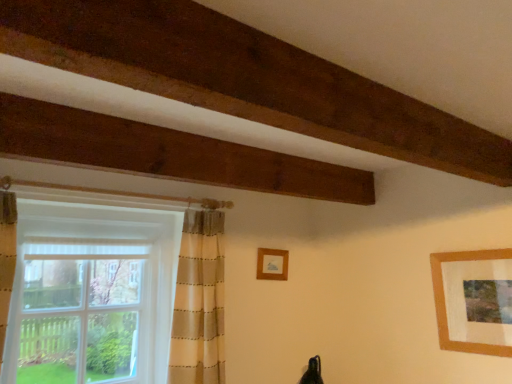
The height and width of the screenshot is (384, 512). What do you see at coordinates (272, 264) in the screenshot?
I see `wooden frame at center, positioned as the 1th picture frame in back-to-front order` at bounding box center [272, 264].

The height and width of the screenshot is (384, 512). I want to click on white sheer curtain at left, so click(91, 294).

Is wooden frame at center, positioned as the 1th picture frame in back-to-front order, located outside white sheer curtain at left?

Yes, wooden frame at center, positioned as the 1th picture frame in back-to-front order, is located beyond the bounds of white sheer curtain at left.

Based on the photo, looking at the image, does wooden frame at center, which ranks as the 2th picture frame in front-to-back order, seem bigger or smaller compared to white sheer curtain at left?

wooden frame at center, which ranks as the 2th picture frame in front-to-back order, is smaller than white sheer curtain at left.

Considering the sizes of objects wooden picture frame at upper right, which appears as the first picture frame when viewed from the right, and wooden frame at center, the 1th picture frame when ordered from left to right, in the image provided, who is taller, wooden picture frame at upper right, which appears as the first picture frame when viewed from the right, or wooden frame at center, the 1th picture frame when ordered from left to right,?

With more height is wooden picture frame at upper right, which appears as the first picture frame when viewed from the right.

Find the location of a particular element. This screenshot has height=384, width=512. picture frame on the right of wooden frame at center, positioned as the 1th picture frame in back-to-front order is located at coordinates (445, 300).

In the scene shown: From the image's perspective, is wooden picture frame at upper right, which is the first picture frame from front to back, on wooden frame at center, which ranks as the 2th picture frame in front-to-back order?

No, from the image's perspective, wooden picture frame at upper right, which is the first picture frame from front to back, is not on top of wooden frame at center, which ranks as the 2th picture frame in front-to-back order.

How different are the orientations of wooden picture frame at upper right, the 2th picture frame when ordered from left to right, and white sheer curtain at left in degrees?

They differ by 88.7 degrees in their facing directions.

Which of these two, wooden picture frame at upper right, which appears as the first picture frame when viewed from the right, or white sheer curtain at left, is wider?

white sheer curtain at left is wider.

From a real-world perspective, relative to white sheer curtain at left, is wooden picture frame at upper right, the 2th picture frame when ordered from left to right, vertically above or below?

From a real-world perspective, wooden picture frame at upper right, the 2th picture frame when ordered from left to right, is physically below white sheer curtain at left.

From the image's perspective, which is above, wooden picture frame at upper right, which appears as the first picture frame when viewed from the right, or white sheer curtain at left?

A: white sheer curtain at left is shown above in the image.

Considering the sizes of objects wooden frame at center, positioned as the 1th picture frame in back-to-front order, and wooden picture frame at upper right, which is the 2th picture frame in back-to-front order, in the image provided, who is wider, wooden frame at center, positioned as the 1th picture frame in back-to-front order, or wooden picture frame at upper right, which is the 2th picture frame in back-to-front order,?

wooden frame at center, positioned as the 1th picture frame in back-to-front order.

Is wooden frame at center, which ranks as the 2th picture frame in front-to-back order, positioned before wooden picture frame at upper right, the 2th picture frame when ordered from left to right?

No.

Does wooden frame at center, positioned as the 1th picture frame in back-to-front order, have a larger size compared to wooden picture frame at upper right, which appears as the first picture frame when viewed from the right?

No.

Who is bigger, white sheer curtain at left or wooden frame at center, which ranks as the 2th picture frame in front-to-back order?

Bigger between the two is white sheer curtain at left.

From the image's perspective, which object appears higher, white sheer curtain at left or wooden frame at center, positioned as the 1th picture frame in back-to-front order?

wooden frame at center, positioned as the 1th picture frame in back-to-front order, appears higher in the image.

Is white sheer curtain at left not within wooden frame at center, the 1th picture frame when ordered from left to right?

white sheer curtain at left is positioned outside wooden frame at center, the 1th picture frame when ordered from left to right.

Can you tell me how much white sheer curtain at left and wooden frame at center, the 1th picture frame when ordered from left to right, differ in facing direction?

They differ by 1.34 degrees in their facing directions.

Is point (18, 355) closer or farther from the camera than point (442, 345)?

Clearly, point (18, 355) is closer to the camera than point (442, 345).

Where is `window above the wooden picture frame at upper right, which is the 2th picture frame in back-to-front order (from a real-world perspective)`? window above the wooden picture frame at upper right, which is the 2th picture frame in back-to-front order (from a real-world perspective) is located at coordinates (91, 294).

Which of these two, white sheer curtain at left or wooden picture frame at upper right, which is the 2th picture frame in back-to-front order, stands taller?

white sheer curtain at left is taller.

Considering the relative positions of white sheer curtain at left and wooden picture frame at upper right, the 2th picture frame when ordered from left to right, in the image provided, is white sheer curtain at left to the left of wooden picture frame at upper right, the 2th picture frame when ordered from left to right, from the viewer's perspective?

Yes, white sheer curtain at left is to the left of wooden picture frame at upper right, the 2th picture frame when ordered from left to right.

Image resolution: width=512 pixels, height=384 pixels. In the image, there is a wooden frame at center, the 1th picture frame when ordered from left to right. Find the location of `window below it (from a real-world perspective)`. window below it (from a real-world perspective) is located at coordinates (91, 294).

Locate an element on the screen. picture frame located on the left of wooden picture frame at upper right, which is the 2th picture frame in back-to-front order is located at coordinates (272, 264).

Based on the photo, estimate the real-world distances between objects in this image. Which object is closer to wooden frame at center, which is counted as the 2th picture frame, starting from the right, white sheer curtain at left or wooden picture frame at upper right, which is the 2th picture frame in back-to-front order?

white sheer curtain at left.

When comparing their distances from wooden frame at center, positioned as the 1th picture frame in back-to-front order, does wooden picture frame at upper right, which is the first picture frame from front to back, or white sheer curtain at left seem closer?

white sheer curtain at left.

Which object lies nearer to the anchor point white sheer curtain at left, wooden frame at center, which is counted as the 2th picture frame, starting from the right, or wooden picture frame at upper right, which appears as the first picture frame when viewed from the right?

Based on the image, wooden frame at center, which is counted as the 2th picture frame, starting from the right, appears to be nearer to white sheer curtain at left.

Considering their positions, is white sheer curtain at left positioned further to wooden picture frame at upper right, which appears as the first picture frame when viewed from the right, than wooden frame at center, the 1th picture frame when ordered from left to right?

The object further to wooden picture frame at upper right, which appears as the first picture frame when viewed from the right, is white sheer curtain at left.

Which object lies further to the anchor point white sheer curtain at left, wooden picture frame at upper right, which is the first picture frame from front to back, or wooden frame at center, positioned as the 1th picture frame in back-to-front order?

wooden picture frame at upper right, which is the first picture frame from front to back, is further to white sheer curtain at left.

From the picture: When comparing their distances from wooden picture frame at upper right, which is the first picture frame from front to back, does wooden frame at center, which ranks as the 2th picture frame in front-to-back order, or white sheer curtain at left seem closer?

→ wooden frame at center, which ranks as the 2th picture frame in front-to-back order, is positioned closer to the anchor wooden picture frame at upper right, which is the first picture frame from front to back.

At what (x,y) coordinates should I click in order to perform the action: click on picture frame between white sheer curtain at left and wooden picture frame at upper right, the 2th picture frame when ordered from left to right. Please return your answer as a coordinate pair (x, y). This screenshot has width=512, height=384. Looking at the image, I should click on (272, 264).